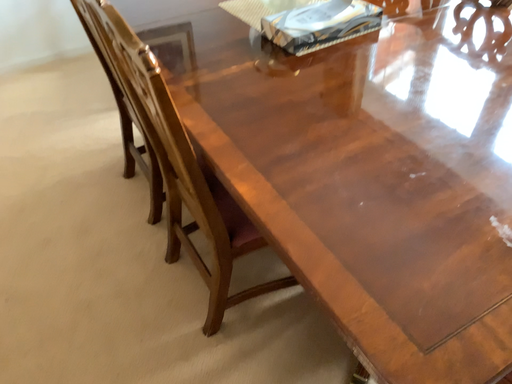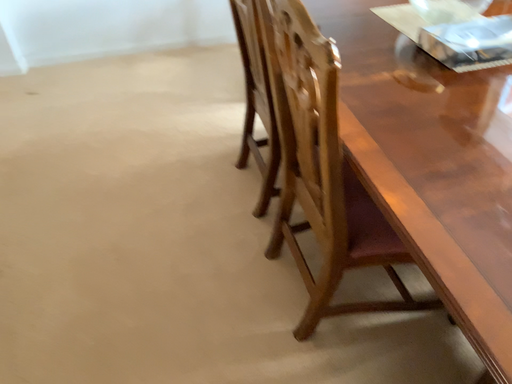
Question: How did the camera likely rotate when shooting the video?

Choices:
 (A) rotated right
 (B) rotated left

Answer: (B)